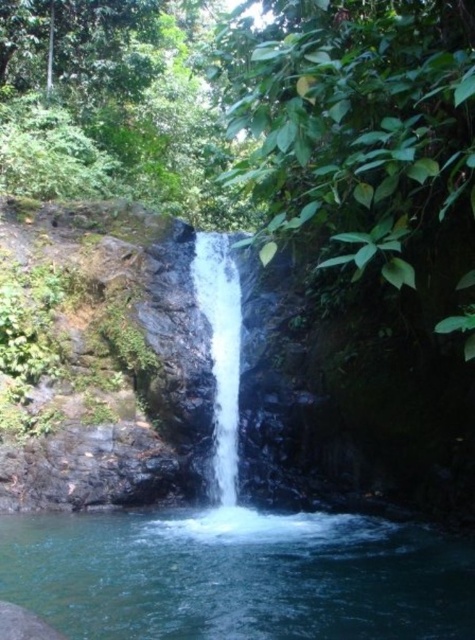
Question: Which object is farther from the camera taking this photo?

Choices:
 (A) white smooth waterfall at center
 (B) clear blue water at center

Answer: (A)

Question: Does clear blue water at center appear over white smooth waterfall at center?

Choices:
 (A) yes
 (B) no

Answer: (B)

Question: Which object is closer to the camera taking this photo?

Choices:
 (A) clear blue water at center
 (B) white smooth waterfall at center

Answer: (A)

Question: Does clear blue water at center come in front of white smooth waterfall at center?

Choices:
 (A) yes
 (B) no

Answer: (A)

Question: Does clear blue water at center have a greater width compared to white smooth waterfall at center?

Choices:
 (A) yes
 (B) no

Answer: (A)